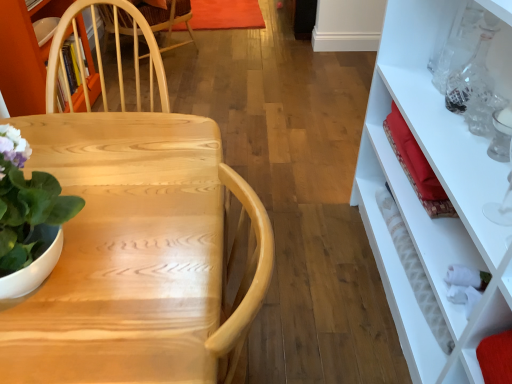
Question: Does point (439, 326) appear closer or farther from the camera than point (1, 195)?

Choices:
 (A) farther
 (B) closer

Answer: (A)

Question: In terms of height, does white textured bottle at right, the second bottle positioned from the top, look taller or shorter compared to green matte plant at left?

Choices:
 (A) tall
 (B) short

Answer: (B)

Question: Which of these objects is positioned closest to the natural wood desk at center?

Choices:
 (A) green matte plant at left
 (B) white textured bottle at right, arranged as the 2th bottle when viewed from the right
 (C) transparent glass bottle at upper right, the 2th bottle in the left-to-right sequence

Answer: (A)

Question: Based on their relative distances, which object is farther from the green matte plant at left?

Choices:
 (A) transparent glass bottle at upper right, which ranks as the 2th bottle in bottom-to-top order
 (B) natural wood desk at center
 (C) white textured bottle at right, the 1th bottle in the left-to-right sequence

Answer: (A)